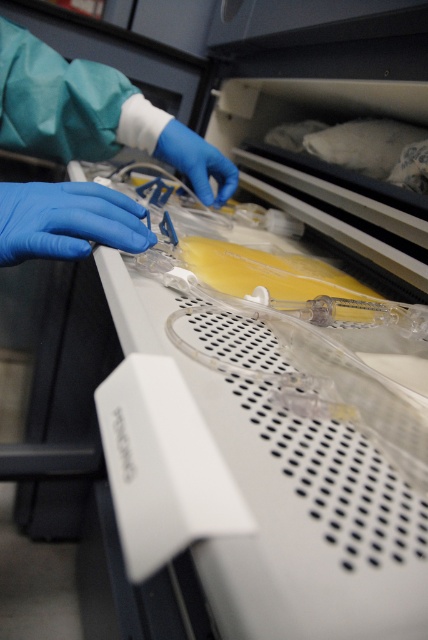
Question: Based on their relative distances, which object is nearer to the blue latex glove at center?

Choices:
 (A) blue rubber glove at left
 (B) blue latex gloves at upper left

Answer: (B)

Question: Can you confirm if blue rubber glove at left is wider than blue latex glove at center?

Choices:
 (A) no
 (B) yes

Answer: (A)

Question: Where is blue latex gloves at upper left located in relation to blue rubber glove at left in the image?

Choices:
 (A) right
 (B) left

Answer: (B)

Question: Which object is farther from the camera taking this photo?

Choices:
 (A) blue latex gloves at upper left
 (B) blue latex glove at center
 (C) blue rubber glove at left

Answer: (B)

Question: Which object is positioned farthest from the blue latex gloves at upper left?

Choices:
 (A) blue rubber glove at left
 (B) blue latex glove at center

Answer: (A)

Question: Can you confirm if blue rubber glove at left is thinner than blue latex glove at center?

Choices:
 (A) no
 (B) yes

Answer: (B)